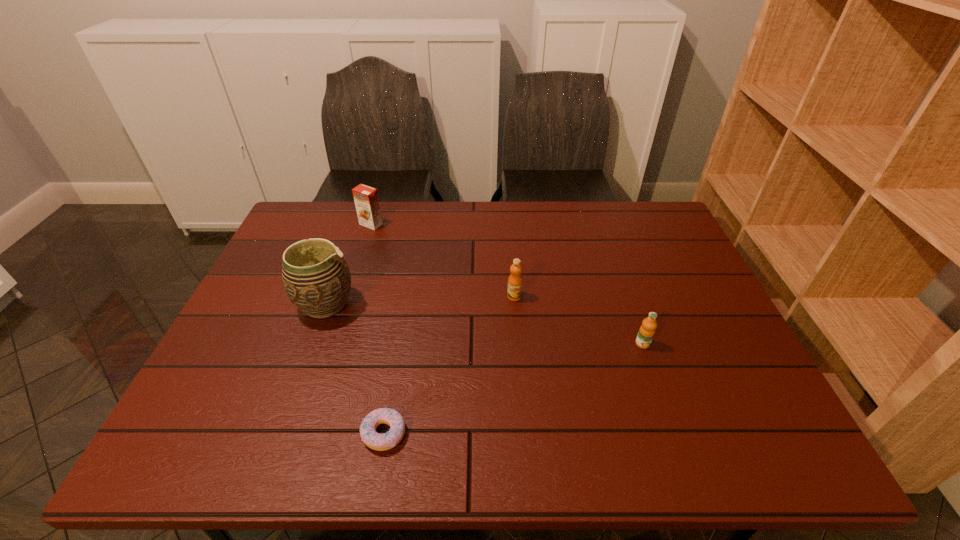
Identify the location of free space at the right edge of the desktop. The width and height of the screenshot is (960, 540). (696, 366).

Identify the location of free space at the far right corner. (630, 222).

Locate an element on the screen. This screenshot has height=540, width=960. free space between the farthest orange juice and the second nearest orange juice is located at coordinates (443, 260).

Locate an element on the screen. The image size is (960, 540). empty location between the farthest orange juice and the pottery is located at coordinates (348, 264).

The height and width of the screenshot is (540, 960). What are the coordinates of `unoccupied position between the leftmost orange juice and the second object from right to left` in the screenshot? It's located at (443, 260).

This screenshot has height=540, width=960. I want to click on free point between the fourth object from left to right and the farthest orange juice, so click(443, 260).

I want to click on free space between the leftmost orange juice and the second nearest object, so click(507, 284).

The width and height of the screenshot is (960, 540). I want to click on vacant space that is in between the second orange juice from left to right and the nearest orange juice, so click(579, 320).

The height and width of the screenshot is (540, 960). Identify the location of blank region between the shortest orange juice and the pottery. (484, 324).

Where is `free point between the doughnut and the fourth tallest object`? free point between the doughnut and the fourth tallest object is located at coordinates (514, 388).